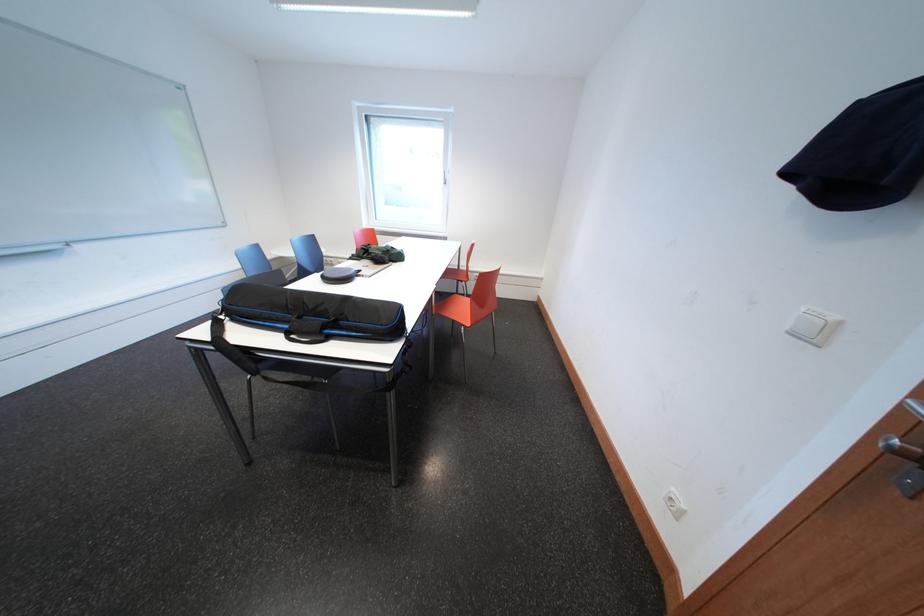
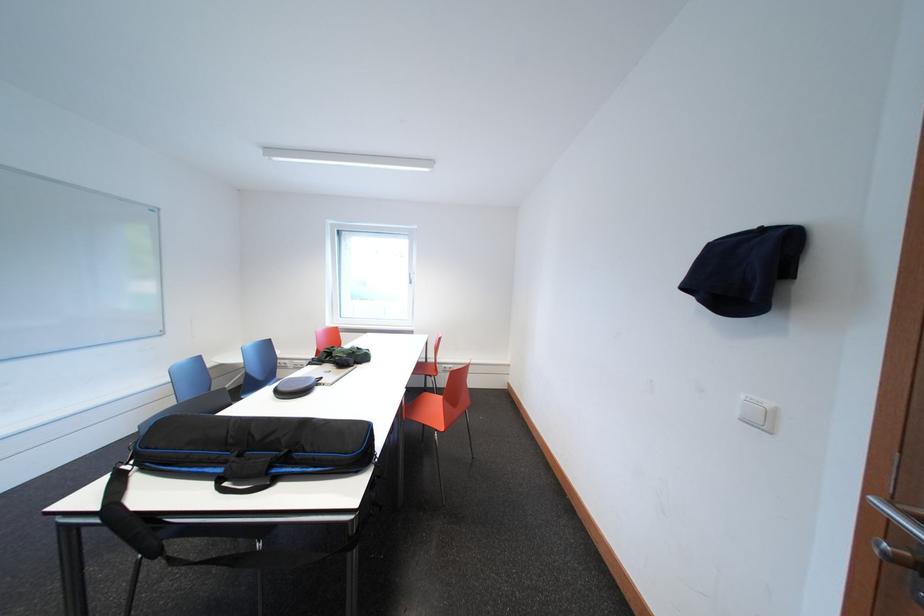
Question: The images are taken continuously from a first-person perspective. In which direction is your viewpoint rotating?

Choices:
 (A) Left
 (B) Right
 (C) Up
 (D) Down

Answer: (C)